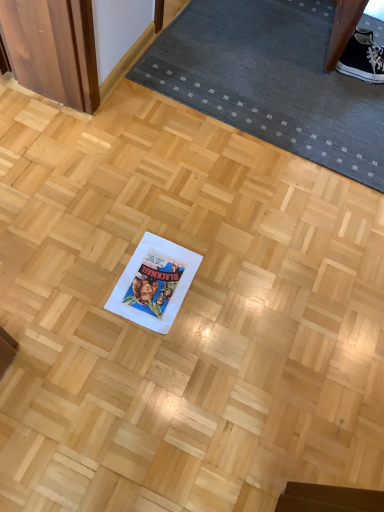
This screenshot has width=384, height=512. What are the coordinates of `free point below dark gray textured mat at upper center (from a real-world perspective)` in the screenshot? It's located at (268, 53).